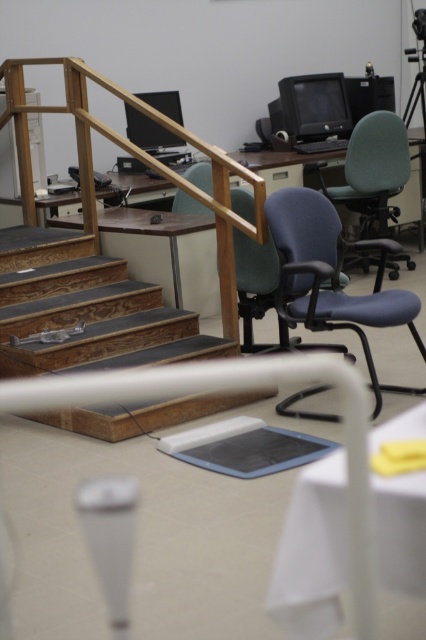
Question: Which point is closer to the camera?

Choices:
 (A) (363, 200)
 (B) (209, 291)

Answer: (B)

Question: Is blue fabric swivel chair at center further to the viewer compared to matte green swivel chair at center right?

Choices:
 (A) yes
 (B) no

Answer: (B)

Question: Is white plastic table at center above matte white table at center?

Choices:
 (A) yes
 (B) no

Answer: (B)

Question: From the image, what is the correct spatial relationship of white plastic table at center in relation to matte white table at center?

Choices:
 (A) below
 (B) above

Answer: (A)

Question: Which object is positioned closest to the wooden stairs at center?

Choices:
 (A) white plastic table at center
 (B) blue fabric swivel chair at center

Answer: (B)

Question: Among these points, which one is farthest from the camera?

Choices:
 (A) (319, 164)
 (B) (144, 252)
 (C) (310, 240)
 (D) (60, 346)

Answer: (A)